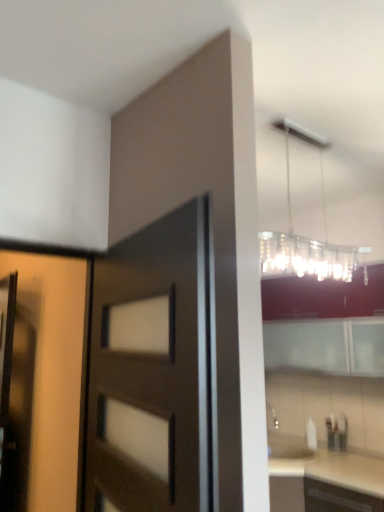
This screenshot has width=384, height=512. What do you see at coordinates (154, 370) in the screenshot?
I see `matte brown door at center, which ranks as the 2th door in left-to-right order` at bounding box center [154, 370].

This screenshot has width=384, height=512. Describe the element at coordinates (15, 396) in the screenshot. I see `matte brown screen door at left` at that location.

At what (x,y) coordinates should I click in order to perform the action: click on clear glass chandelier at upper right. Please return your answer as a coordinate pair (x, y). Looking at the image, I should click on (306, 237).

What is the approximate height of clear glass chandelier at upper right?

75.76 centimeters.

Measure the distance between white glossy cabinet at upper right and camera.

white glossy cabinet at upper right and camera are 8.78 feet apart from each other.

Image resolution: width=384 pixels, height=512 pixels. Describe the element at coordinates (325, 323) in the screenshot. I see `white glossy cabinet at upper right` at that location.

The width and height of the screenshot is (384, 512). Describe the element at coordinates (53, 372) in the screenshot. I see `matte wood door at left, acting as the second door starting from the right` at that location.

You are a GUI agent. You are given a task and a screenshot of the screen. Output one action in this format:
    pyautogui.click(x=<x>, y=<y>)
    Task: Click on the matte brown door at center, marked as the first door in a right-to-left arrangement
    Image resolution: width=384 pixels, height=512 pixels.
    Given the screenshot: What is the action you would take?
    pyautogui.click(x=154, y=370)

Which point is more forward, [323,369] or [287,184]?

The point [323,369] is closer to the camera.

Locate an element on the screen. The image size is (384, 512). cabinetry below the clear glass chandelier at upper right (from the image's perspective) is located at coordinates (325, 323).

From the image's perspective, is white glossy cabinet at upper right below clear glass chandelier at upper right?

Yes, from the image's perspective, white glossy cabinet at upper right is beneath clear glass chandelier at upper right.

Are white glossy cabinet at upper right and clear glass chandelier at upper right far apart?

That's not correct — white glossy cabinet at upper right is a little close to clear glass chandelier at upper right.

Which object is more forward, matte brown door at center, marked as the first door in a right-to-left arrangement, or white glossy cabinet at upper right?

matte brown door at center, marked as the first door in a right-to-left arrangement, is more forward.

Is matte brown door at center, marked as the first door in a right-to-left arrangement, placed right next to white glossy cabinet at upper right?

No, matte brown door at center, marked as the first door in a right-to-left arrangement, is not with white glossy cabinet at upper right.

Where is `the 2nd door below the white glossy cabinet at upper right (from a real-world perspective)`? the 2nd door below the white glossy cabinet at upper right (from a real-world perspective) is located at coordinates (154, 370).

Which is in front, point (171, 481) or point (364, 365)?

The point (171, 481) is closer to the camera.

Looking at this image, from the image's perspective, between matte wood door at left, placed as the 1th door when sorted from left to right, and matte brown screen door at left, who is located below?

matte brown screen door at left is shown below in the image.

Would you say matte wood door at left, placed as the 1th door when sorted from left to right, is outside matte brown screen door at left?

Absolutely, matte wood door at left, placed as the 1th door when sorted from left to right, is external to matte brown screen door at left.

In the scene shown: How different are the orientations of matte wood door at left, placed as the 1th door when sorted from left to right, and matte brown screen door at left in degrees?

98 degrees.

Which is in front, point (39, 398) or point (14, 301)?

Positioned in front is point (39, 398).

Considering the relative sizes of white glossy cabinet at upper right and matte brown screen door at left in the image provided, is white glossy cabinet at upper right thinner than matte brown screen door at left?

In fact, white glossy cabinet at upper right might be wider than matte brown screen door at left.

How distant is white glossy cabinet at upper right from matte brown screen door at left?

white glossy cabinet at upper right and matte brown screen door at left are 1.92 meters apart.

Which of these two, white glossy cabinet at upper right or matte brown screen door at left, stands shorter?

white glossy cabinet at upper right.

Is point (190, 220) farther from camera compared to point (6, 430)?

No, it is not.

Is matte brown door at center, marked as the first door in a right-to-left arrangement, bigger than matte brown screen door at left?

Indeed, matte brown door at center, marked as the first door in a right-to-left arrangement, has a larger size compared to matte brown screen door at left.

From a real-world perspective, which object rests below the other?

In real-world perspective, matte brown screen door at left is lower.

From the image's perspective, is matte wood door at left, placed as the 1th door when sorted from left to right, located above or below matte brown door at center, marked as the first door in a right-to-left arrangement?

From the image's perspective, matte wood door at left, placed as the 1th door when sorted from left to right, appears below matte brown door at center, marked as the first door in a right-to-left arrangement.

Considering the relative sizes of matte wood door at left, placed as the 1th door when sorted from left to right, and matte brown door at center, marked as the first door in a right-to-left arrangement, in the image provided, is matte wood door at left, placed as the 1th door when sorted from left to right, bigger than matte brown door at center, marked as the first door in a right-to-left arrangement,?

No.

Based on the photo, is matte wood door at left, placed as the 1th door when sorted from left to right, taller than matte brown door at center, which ranks as the 2th door in left-to-right order?

No, matte wood door at left, placed as the 1th door when sorted from left to right, is not taller than matte brown door at center, which ranks as the 2th door in left-to-right order.

Are matte wood door at left, placed as the 1th door when sorted from left to right, and matte brown door at center, marked as the first door in a right-to-left arrangement, making contact?

No, matte wood door at left, placed as the 1th door when sorted from left to right, is not in contact with matte brown door at center, marked as the first door in a right-to-left arrangement.

Between matte wood door at left, placed as the 1th door when sorted from left to right, and clear glass chandelier at upper right, which one appears on the right side from the viewer's perspective?

clear glass chandelier at upper right is more to the right.

Is matte wood door at left, acting as the second door starting from the right, spatially inside clear glass chandelier at upper right, or outside of it?

matte wood door at left, acting as the second door starting from the right, is spatially situated outside clear glass chandelier at upper right.

Consider the image. Which object is further away from the camera, matte wood door at left, placed as the 1th door when sorted from left to right, or clear glass chandelier at upper right?

clear glass chandelier at upper right is further from the camera.

This screenshot has height=512, width=384. I want to click on lamp above the white glossy cabinet at upper right (from a real-world perspective), so click(306, 237).

The width and height of the screenshot is (384, 512). I want to click on cabinetry behind the matte brown door at center, which ranks as the 2th door in left-to-right order, so click(325, 323).

Looking at the image, which one is located further to matte wood door at left, placed as the 1th door when sorted from left to right, white glossy cabinet at upper right or clear glass chandelier at upper right?

white glossy cabinet at upper right is positioned further to the anchor matte wood door at left, placed as the 1th door when sorted from left to right.

Looking at the image, which one is located closer to matte brown screen door at left, white glossy cabinet at upper right or matte brown door at center, which ranks as the 2th door in left-to-right order?

matte brown door at center, which ranks as the 2th door in left-to-right order, is closer to matte brown screen door at left.

When comparing their distances from matte brown door at center, which ranks as the 2th door in left-to-right order, does white glossy cabinet at upper right or matte wood door at left, placed as the 1th door when sorted from left to right, seem closer?

matte wood door at left, placed as the 1th door when sorted from left to right, is positioned closer to the anchor matte brown door at center, which ranks as the 2th door in left-to-right order.

When comparing their distances from white glossy cabinet at upper right, does matte wood door at left, acting as the second door starting from the right, or clear glass chandelier at upper right seem further?

matte wood door at left, acting as the second door starting from the right, lies further to white glossy cabinet at upper right than the other object.

Based on their spatial positions, is white glossy cabinet at upper right or matte brown door at center, marked as the first door in a right-to-left arrangement, closer to matte wood door at left, placed as the 1th door when sorted from left to right?

matte brown door at center, marked as the first door in a right-to-left arrangement, is positioned closer to the anchor matte wood door at left, placed as the 1th door when sorted from left to right.

From the image, which object appears to be farther from white glossy cabinet at upper right, matte brown screen door at left or clear glass chandelier at upper right?

Among the two, matte brown screen door at left is located further to white glossy cabinet at upper right.

From the image, which object appears to be nearer to matte brown screen door at left, matte wood door at left, placed as the 1th door when sorted from left to right, or matte brown door at center, marked as the first door in a right-to-left arrangement?

matte wood door at left, placed as the 1th door when sorted from left to right, is closer to matte brown screen door at left.

Based on their spatial positions, is white glossy cabinet at upper right or matte wood door at left, placed as the 1th door when sorted from left to right, further from matte brown screen door at left?

Among the two, white glossy cabinet at upper right is located further to matte brown screen door at left.

Image resolution: width=384 pixels, height=512 pixels. I want to click on lamp between matte brown screen door at left and white glossy cabinet at upper right in the horizontal direction, so pyautogui.click(x=306, y=237).

At what (x,y) coordinates should I click in order to perform the action: click on lamp situated between matte wood door at left, acting as the second door starting from the right, and white glossy cabinet at upper right from left to right. Please return your answer as a coordinate pair (x, y). The width and height of the screenshot is (384, 512). Looking at the image, I should click on (306, 237).

You are a GUI agent. You are given a task and a screenshot of the screen. Output one action in this format:
    pyautogui.click(x=<x>, y=<y>)
    Task: Click on the door between matte brown door at center, marked as the first door in a right-to-left arrangement, and white glossy cabinet at upper right in the front-back direction
    This screenshot has height=512, width=384.
    Given the screenshot: What is the action you would take?
    pyautogui.click(x=53, y=372)

Locate an element on the screen. This screenshot has width=384, height=512. lamp between matte brown door at center, marked as the first door in a right-to-left arrangement, and white glossy cabinet at upper right, along the z-axis is located at coordinates coord(306,237).